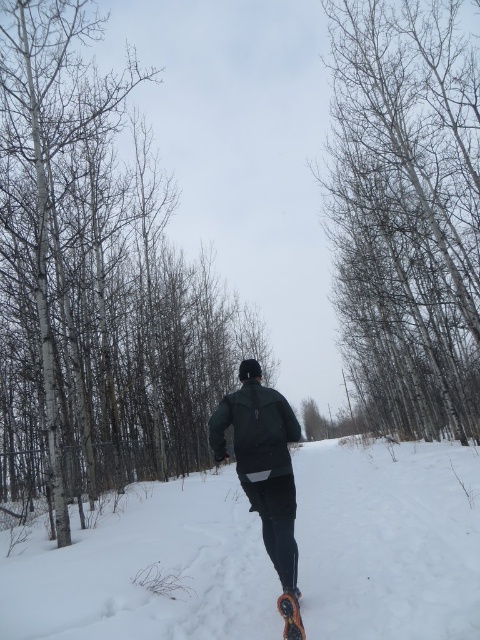
Question: Is the position of smooth white bark at center more distant than that of white fluffy snow at center?

Choices:
 (A) yes
 (B) no

Answer: (A)

Question: Can you confirm if smooth white tree at center is bigger than black rubber snowshoe at lower center?

Choices:
 (A) no
 (B) yes

Answer: (B)

Question: Which of the following is the closest to the observer?

Choices:
 (A) black rubber snowshoe at lower center
 (B) smooth white bark at center
 (C) white fluffy snow at center

Answer: (A)

Question: Which object appears farthest from the camera in this image?

Choices:
 (A) black rubber snowshoe at lower center
 (B) smooth white bark at center
 (C) smooth white tree at center

Answer: (C)

Question: Which object appears farthest from the camera in this image?

Choices:
 (A) white fluffy snow at center
 (B) black rubber snowshoe at lower center

Answer: (A)

Question: Can you confirm if dark green fabric snowboarder at center is positioned to the right of black rubber snowshoe at lower center?

Choices:
 (A) no
 (B) yes

Answer: (A)